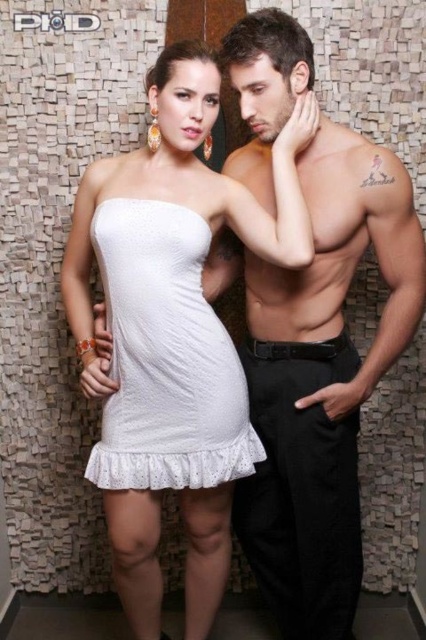
Which is behind, point (111, 413) or point (146, 458)?

Positioned behind is point (111, 413).

Does point (163, 396) come farther from viewer compared to point (241, 476)?

No.

Where is `white lace dress at center`? The image size is (426, 640). white lace dress at center is located at coordinates (166, 356).